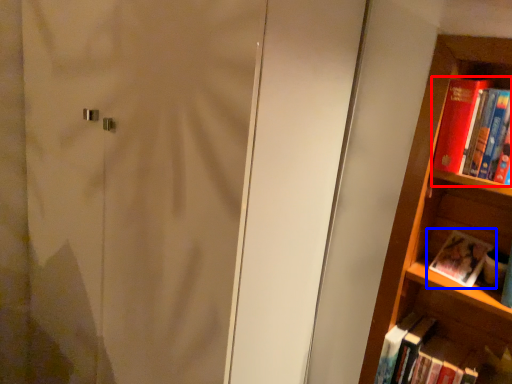
Question: Which object appears closest to the camera in this image, book (highlighted by a red box) or book (highlighted by a blue box)?

Choices:
 (A) book
 (B) book

Answer: (A)